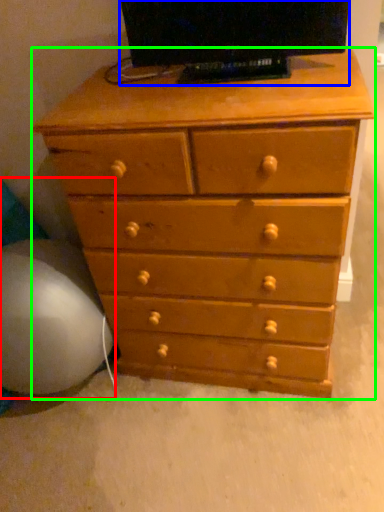
Question: Which object is positioned farthest from bean bag chair (highlighted by a red box)? Select from television (highlighted by a blue box) and chest of drawers (highlighted by a green box).

Choices:
 (A) television
 (B) chest of drawers

Answer: (A)